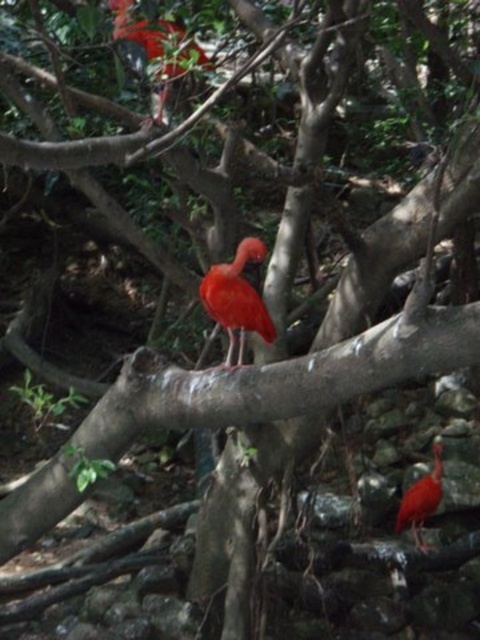
You are a birdwatcher with a camera that has a maximum zoom range of 2 meters. You want to take a photo of the smooth glossy red bird at center and the smooth glossy red bird at lower right in the same frame. Can your camera capture both birds in the same shot without moving the camera?

The distance between the smooth glossy red bird at center and the smooth glossy red bird at lower right is 1.53 meters. Since your camera can zoom up to 2 meters, it should be able to capture both birds in the same frame without moving the camera.

You are a photographer standing in a mangrove forest and see the smooth glossy red bird at center. If your camera has a focal length of 50mm and you want to take a clear photo of the bird without moving closer, what should you do?

The smooth glossy red bird at center is 2.86 meters away from the viewer. To take a clear photo without moving closer, you should use a telephoto lens with a longer focal length than 50mm to capture the bird from this distance.

You are standing in a mangrove forest and see a point marked at coordinates (257, 241). If you want to touch that point with a 10 feet long stick, will you be able to reach it?

The point at (257, 241) is 9.72 feet away from the viewer. Since the stick is 10 feet long, you can reach it with the stick.